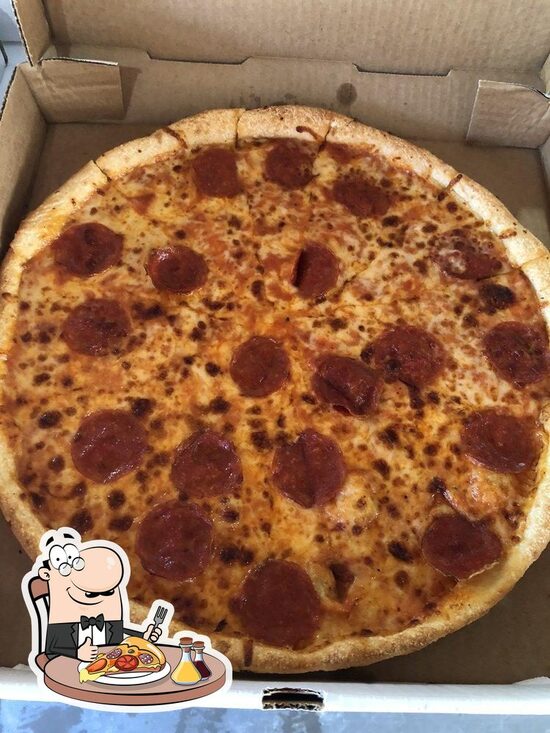
Find the location of a particular element. This screenshot has height=733, width=550. pizza box is located at coordinates (495, 152).